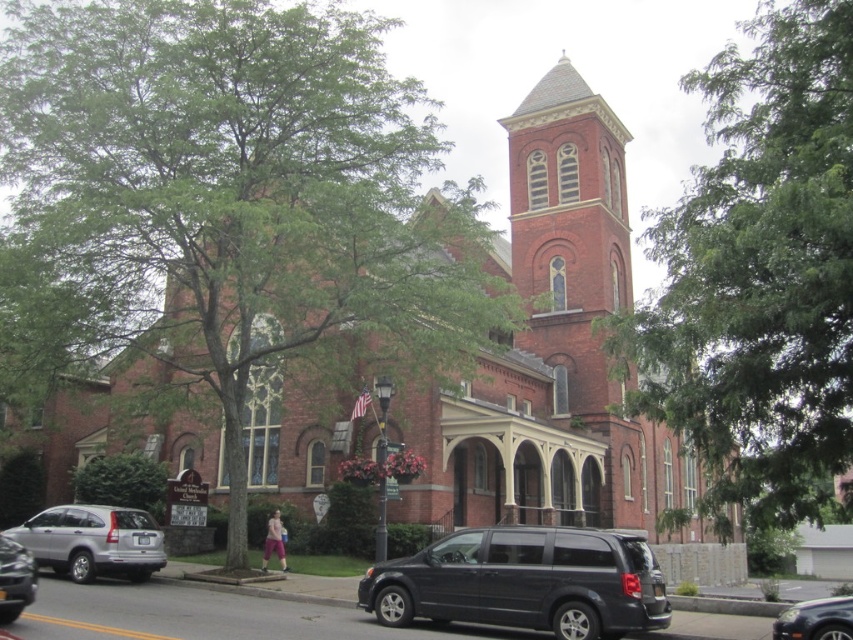
Question: Which point is farther to the camera?

Choices:
 (A) satin silver suv at lower left
 (B) green leafy tree at left
 (C) silver metallic van at lower left

Answer: (A)

Question: Among these objects, which one is farthest from the camera?

Choices:
 (A) satin silver suv at lower left
 (B) green leafy tree at upper right
 (C) green leafy tree at left
 (D) shiny black sedan at lower right

Answer: (A)

Question: Is green leafy tree at upper right positioned in front of matte black van at lower center?

Choices:
 (A) no
 (B) yes

Answer: (B)

Question: Which point is farther from the camera taking this photo?

Choices:
 (A) (755, 56)
 (B) (13, 579)

Answer: (A)

Question: Does matte black van at lower center appear on the left side of silver metallic van at lower left?

Choices:
 (A) no
 (B) yes

Answer: (A)

Question: Is shiny black sedan at lower right bigger than silver metallic van at lower left?

Choices:
 (A) yes
 (B) no

Answer: (A)